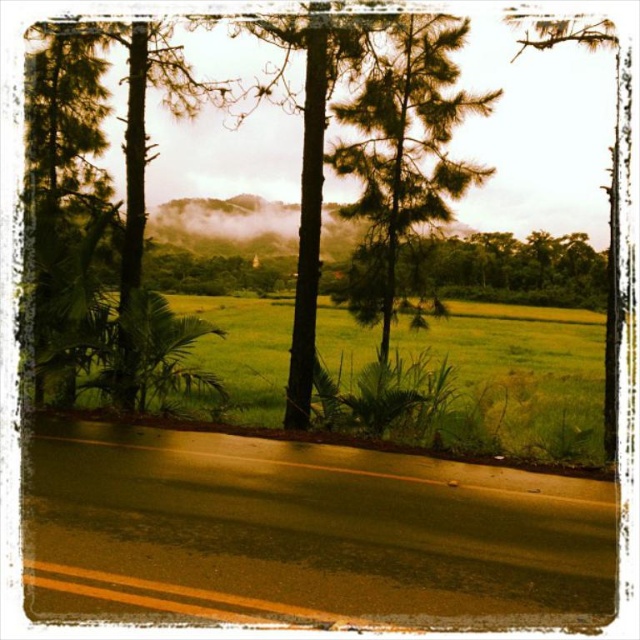
You are a gardener planning to mow the green grass at center and trim the green matte tree at center. Which one has a greater width?

The green grass at center has a greater width than the green matte tree at center.

You are standing at the point closer to the camera between the two points, point (416,380) and point (356,172). Which point are you standing at?

You are standing at point (356,172) because it is closer to the camera than point (416,380).

You are a hiker standing on the road and looking at the two trees in the center. Which tree is closer to you, the green leafy tree at center or the green matte tree at center?

The green leafy tree at center is closer to you because it is located above the green matte tree at center, indicating it is in a more foreground position.